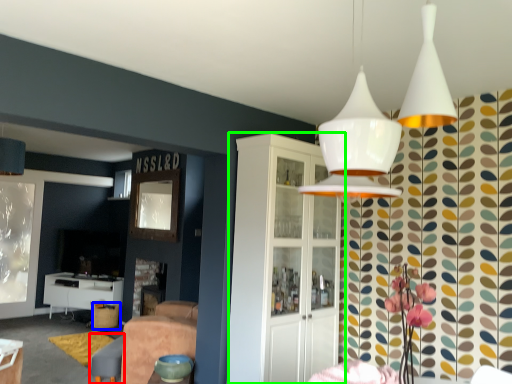
Question: Estimate the real-world distances between objects in this image. Which object is farther from swivel chair (highlighted by a red box), bar stool (highlighted by a blue box) or cabinetry (highlighted by a green box)?

Choices:
 (A) bar stool
 (B) cabinetry

Answer: (B)